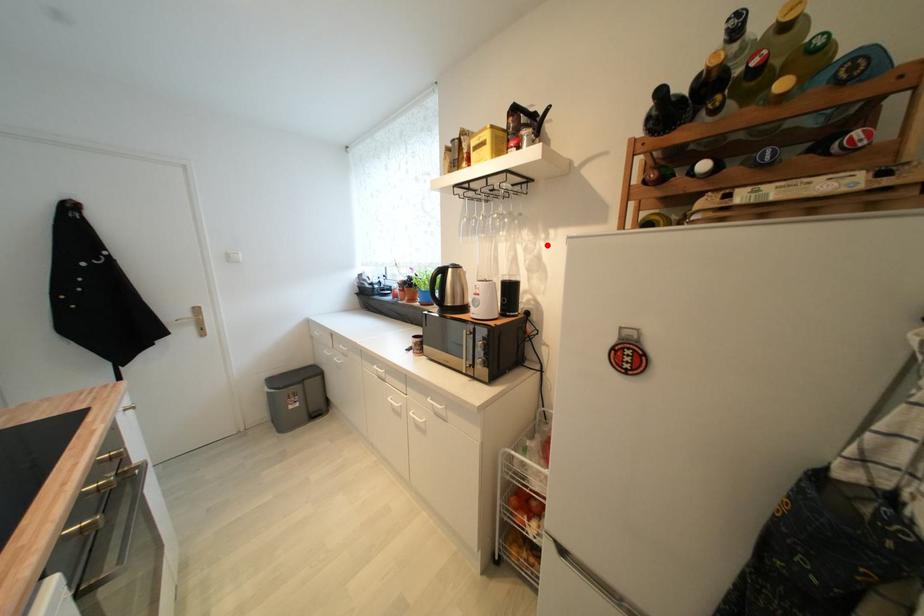
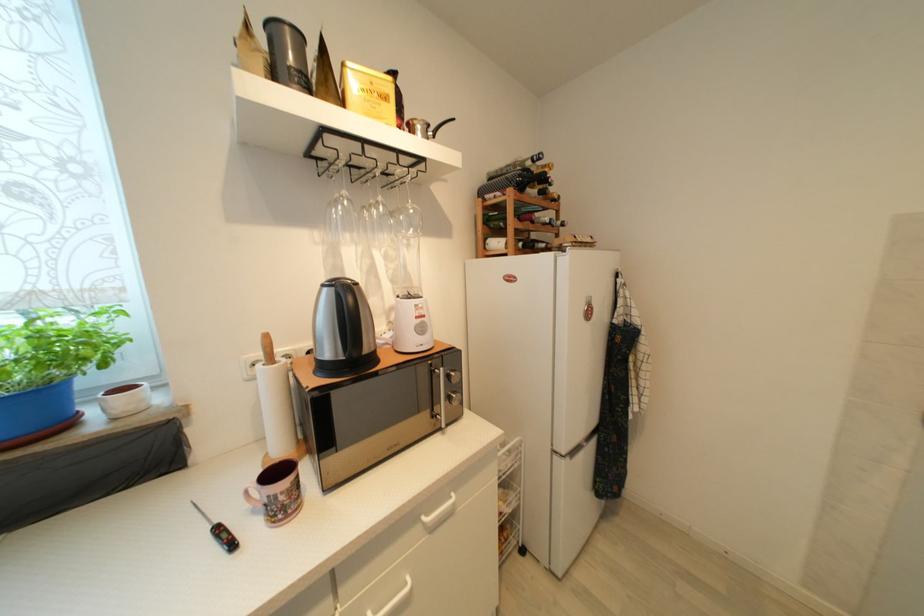
The point at the highlighted location is marked in the first image. Where is the corresponding point in the second image?

(409, 253)